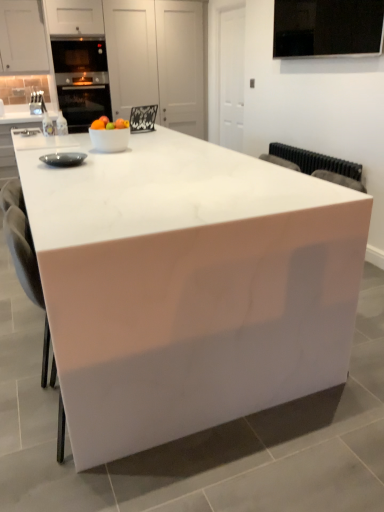
Question: Is white glossy table at center smaller than white glossy bowl at center?

Choices:
 (A) yes
 (B) no

Answer: (B)

Question: Is white glossy table at center in contact with white glossy bowl at center?

Choices:
 (A) yes
 (B) no

Answer: (B)

Question: Considering the relative sizes of white glossy table at center and white glossy bowl at center in the image provided, is white glossy table at center bigger than white glossy bowl at center?

Choices:
 (A) no
 (B) yes

Answer: (B)

Question: Is white glossy table at center positioned with its back to white glossy bowl at center?

Choices:
 (A) no
 (B) yes

Answer: (A)

Question: Is white glossy table at center taller than white glossy bowl at center?

Choices:
 (A) no
 (B) yes

Answer: (B)

Question: From the image's perspective, relative to white glossy table at center, is white glossy bowl at center above or below?

Choices:
 (A) below
 (B) above

Answer: (B)

Question: Which is correct: white glossy bowl at center is inside white glossy table at center, or outside of it?

Choices:
 (A) inside
 (B) outside

Answer: (B)

Question: Relative to white glossy table at center, is white glossy bowl at center in front or behind?

Choices:
 (A) behind
 (B) front

Answer: (A)

Question: Based on their sizes in the image, would you say white glossy bowl at center is bigger or smaller than white glossy table at center?

Choices:
 (A) big
 (B) small

Answer: (B)

Question: Relative to matte black bowl at left, is white glossy table at center in front or behind?

Choices:
 (A) front
 (B) behind

Answer: (A)

Question: Would you say white glossy table at center is to the left or to the right of matte black bowl at left in the picture?

Choices:
 (A) right
 (B) left

Answer: (A)

Question: Considering the positions of white glossy table at center and matte black bowl at left in the image, is white glossy table at center bigger or smaller than matte black bowl at left?

Choices:
 (A) big
 (B) small

Answer: (A)

Question: Considering the positions of white glossy table at center and matte black bowl at left in the image, is white glossy table at center wider or thinner than matte black bowl at left?

Choices:
 (A) thin
 (B) wide

Answer: (B)

Question: Based on their sizes in the image, would you say white glossy table at center is bigger or smaller than white glossy bowl at center?

Choices:
 (A) small
 (B) big

Answer: (B)

Question: In the image, is white glossy table at center positioned in front of or behind white glossy bowl at center?

Choices:
 (A) front
 (B) behind

Answer: (A)